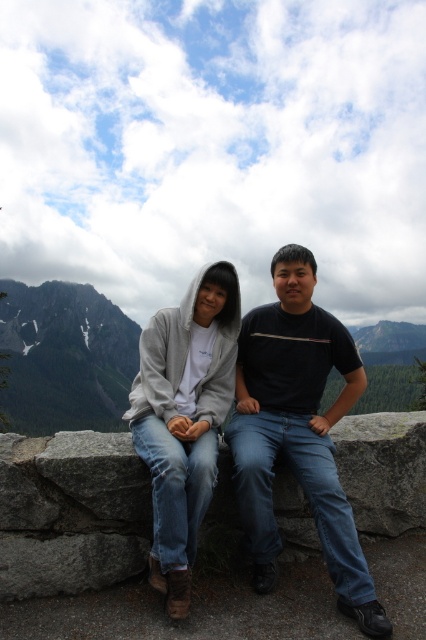
Question: Which object appears closest to the camera in this image?

Choices:
 (A) matte gray hoodie at center
 (B) black matte shirt at center

Answer: (B)

Question: Is black matte shirt at center above gray rocky mountain at left?

Choices:
 (A) yes
 (B) no

Answer: (A)

Question: Can you confirm if matte gray hoodie at center is smaller than gray rocky mountain at left?

Choices:
 (A) yes
 (B) no

Answer: (A)

Question: From the image, what is the correct spatial relationship of matte gray hoodie at center in relation to gray rocky mountain at left?

Choices:
 (A) right
 (B) left

Answer: (A)

Question: Which object appears closest to the camera in this image?

Choices:
 (A) gray rocky mountain at left
 (B) matte gray hoodie at center

Answer: (B)

Question: Among these points, which one is farthest from the camera?

Choices:
 (A) pos(175,548)
 (B) pos(6,346)
 (C) pos(317,472)

Answer: (B)